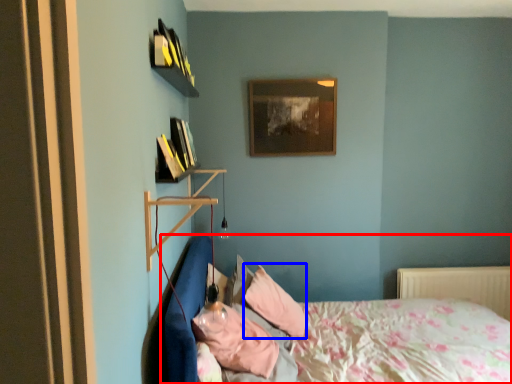
Question: Which object is closer to the camera taking this photo, bed (highlighted by a red box) or pillow (highlighted by a blue box)?

Choices:
 (A) bed
 (B) pillow

Answer: (A)